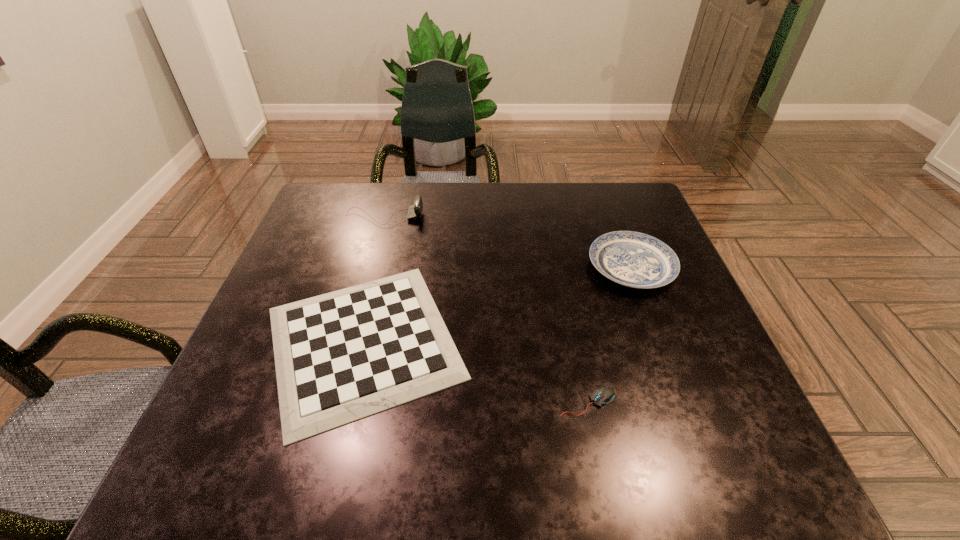
Where is `object at the far edge`? The height and width of the screenshot is (540, 960). object at the far edge is located at coordinates (415, 210).

Identify the location of object at the near edge. (342, 356).

Identify the location of webcam at the left edge. (415, 210).

Identify the location of chessboard situated at the left edge. (342, 356).

The height and width of the screenshot is (540, 960). I want to click on object that is at the right edge, so click(633, 259).

Where is `object situated at the far left corner`? This screenshot has width=960, height=540. object situated at the far left corner is located at coordinates (415, 210).

The height and width of the screenshot is (540, 960). I want to click on object present at the near left corner, so click(342, 356).

This screenshot has width=960, height=540. In the image, there is a desktop. What are the coordinates of `free region at the far edge` in the screenshot? It's located at (561, 205).

I want to click on free location at the near edge, so click(x=460, y=471).

At what (x,y) coordinates should I click in order to perform the action: click on vacant space at the left edge. Please return your answer as a coordinate pair (x, y). This screenshot has height=540, width=960. Looking at the image, I should click on click(314, 270).